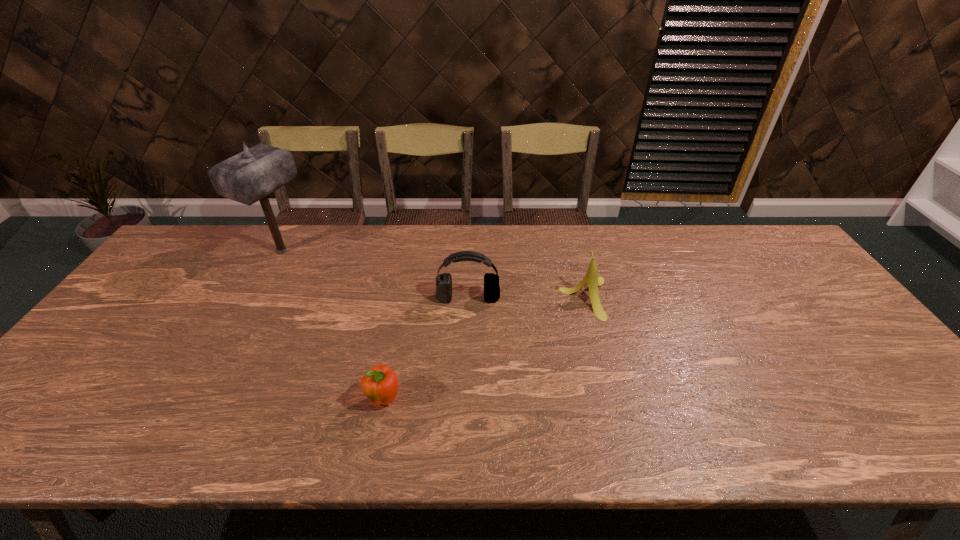
Identify the location of free space between the rightmost object and the second object from right to left. (526, 298).

This screenshot has width=960, height=540. In order to click on free area in between the farthest object and the pepper in this screenshot , I will do `click(334, 326)`.

This screenshot has width=960, height=540. Find the location of `vacant space that's between the headset and the banana`. vacant space that's between the headset and the banana is located at coordinates (526, 298).

What are the coordinates of `blank region between the third object from left to right and the tallest object` in the screenshot? It's located at (375, 274).

Locate an element on the screen. vacant space in between the pepper and the rightmost object is located at coordinates (485, 350).

Find the location of a particular element. free space between the rightmost object and the pepper is located at coordinates click(485, 350).

Locate an element on the screen. The width and height of the screenshot is (960, 540). free spot between the third shortest object and the leftmost object is located at coordinates (375, 274).

At what (x,y) coordinates should I click in order to perform the action: click on free space between the mallet and the nearest object. Please return your answer as a coordinate pair (x, y). The height and width of the screenshot is (540, 960). Looking at the image, I should click on (334, 326).

Identify the location of object that is the third closest to the tallest object. (591, 278).

Locate which object ranks third in proximity to the tallest object. Please provide its 2D coordinates. Your answer should be formatted as a tuple, i.e. [(x, y)], where the tuple contains the x and y coordinates of a point satisfying the conditions above.

[(591, 278)]